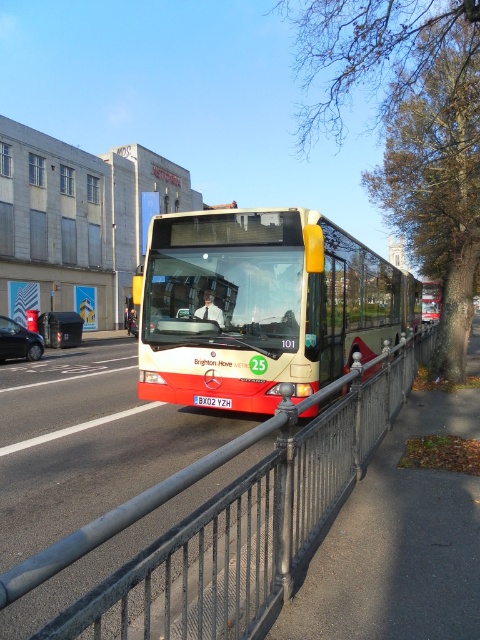
Who is positioned more to the left, metallic gray fence at center or white glossy bus at center?

From the viewer's perspective, metallic gray fence at center appears more on the left side.

Does metallic gray fence at center appear under white glossy bus at center?

Yes.

Is point (216, 620) less distant than point (147, 268)?

Yes, it is.

The height and width of the screenshot is (640, 480). I want to click on metallic gray fence at center, so click(230, 522).

Can you confirm if white glossy bus at center is smaller than metallic bus stop at center?

Incorrect, white glossy bus at center is not smaller in size than metallic bus stop at center.

What do you see at coordinates (260, 307) in the screenshot? The width and height of the screenshot is (480, 640). I see `white glossy bus at center` at bounding box center [260, 307].

This screenshot has width=480, height=640. Identify the location of white glossy bus at center. (260, 307).

Is metallic gray fence at center closer to the viewer compared to metallic bus stop at center?

Yes, metallic gray fence at center is in front of metallic bus stop at center.

How far apart are metallic gray fence at center and metallic bus stop at center?

metallic gray fence at center is 20.88 meters from metallic bus stop at center.

You are a GUI agent. You are given a task and a screenshot of the screen. Output one action in this format:
    pyautogui.click(x=<x>, y=<y>)
    Task: Click on the metallic gray fence at center
    
    Given the screenshot: What is the action you would take?
    pyautogui.click(x=230, y=522)